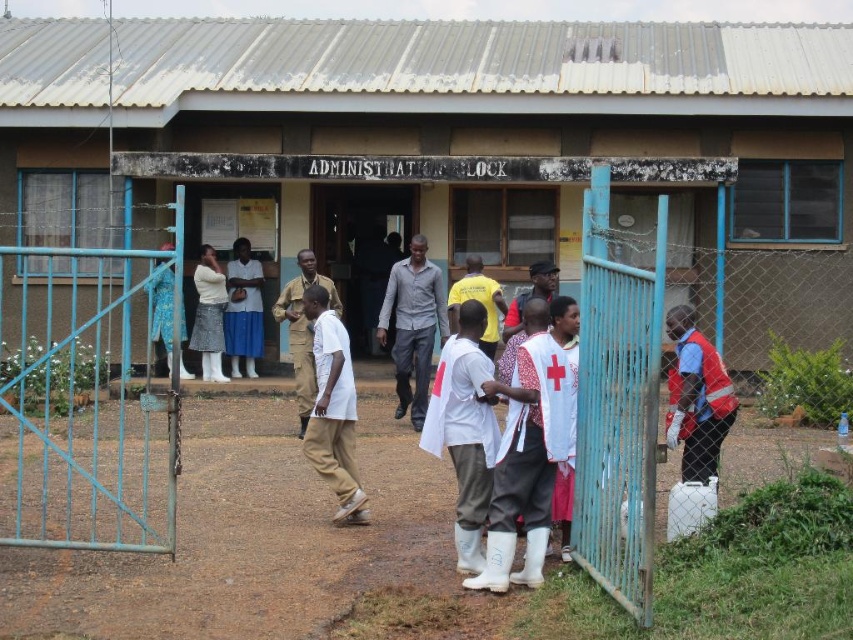
Question: Does blue metal gate at left appear under white textured skirt at center?

Choices:
 (A) no
 (B) yes

Answer: (A)

Question: Estimate the real-world distances between objects in this image. Which object is farther from the white matte pants at center?

Choices:
 (A) yellow matte shirt at center
 (B) reflective orange vest at right
 (C) khaki uniform at center
 (D) gray matte shirt at center

Answer: (D)

Question: Estimate the real-world distances between objects in this image. Which object is farther from the brown corrugated metal hut at center?

Choices:
 (A) white textured skirt at center
 (B) khaki uniform at center

Answer: (B)

Question: Which of the following is the farthest from the observer?

Choices:
 (A) khaki uniform at center
 (B) white fabric skirt at center

Answer: (B)

Question: Is reflective orange vest at right behind white fabric skirt at center?

Choices:
 (A) yes
 (B) no

Answer: (B)

Question: Does white fabric skirt at center appear on the right side of khaki uniform at center?

Choices:
 (A) yes
 (B) no

Answer: (B)